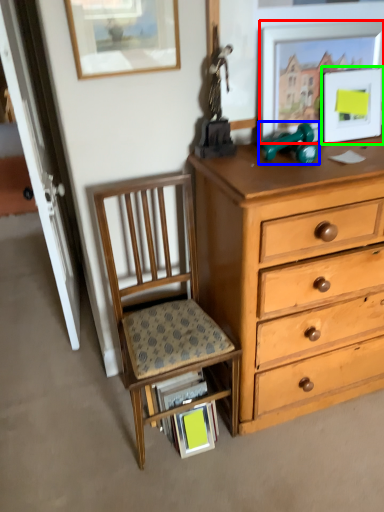
Question: Estimate the real-world distances between objects in this image. Which object is closer to picture frame (highlighted by a red box), toy (highlighted by a blue box) or picture frame (highlighted by a green box)?

Choices:
 (A) toy
 (B) picture frame

Answer: (B)